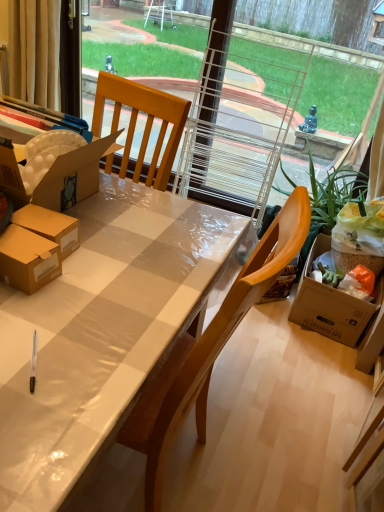
Question: From the image's perspective, would you say green leafy plant at right is positioned over beige fabric curtain at upper left?

Choices:
 (A) yes
 (B) no

Answer: (B)

Question: From the image's perspective, would you say green leafy plant at right is shown under beige fabric curtain at upper left?

Choices:
 (A) no
 (B) yes

Answer: (B)

Question: Can you confirm if green leafy plant at right is shorter than beige fabric curtain at upper left?

Choices:
 (A) yes
 (B) no

Answer: (B)

Question: Is green leafy plant at right located outside beige fabric curtain at upper left?

Choices:
 (A) yes
 (B) no

Answer: (A)

Question: Is green leafy plant at right turned away from beige fabric curtain at upper left?

Choices:
 (A) yes
 (B) no

Answer: (B)

Question: From a real-world perspective, is green leafy plant at right on top of beige fabric curtain at upper left?

Choices:
 (A) yes
 (B) no

Answer: (B)

Question: Does matte plastic desk at center touch beige fabric curtain at upper left?

Choices:
 (A) yes
 (B) no

Answer: (B)

Question: Could you tell me if matte plastic desk at center is facing beige fabric curtain at upper left?

Choices:
 (A) no
 (B) yes

Answer: (A)

Question: From a real-world perspective, is matte plastic desk at center located beneath beige fabric curtain at upper left?

Choices:
 (A) no
 (B) yes

Answer: (B)

Question: Is matte plastic desk at center bigger than beige fabric curtain at upper left?

Choices:
 (A) no
 (B) yes

Answer: (B)

Question: Is matte plastic desk at center surrounding beige fabric curtain at upper left?

Choices:
 (A) yes
 (B) no

Answer: (B)

Question: Considering the relative sizes of matte plastic desk at center and beige fabric curtain at upper left in the image provided, is matte plastic desk at center shorter than beige fabric curtain at upper left?

Choices:
 (A) no
 (B) yes

Answer: (A)

Question: Can you confirm if matte plastic desk at center is thinner than green leafy plant at right?

Choices:
 (A) yes
 (B) no

Answer: (B)